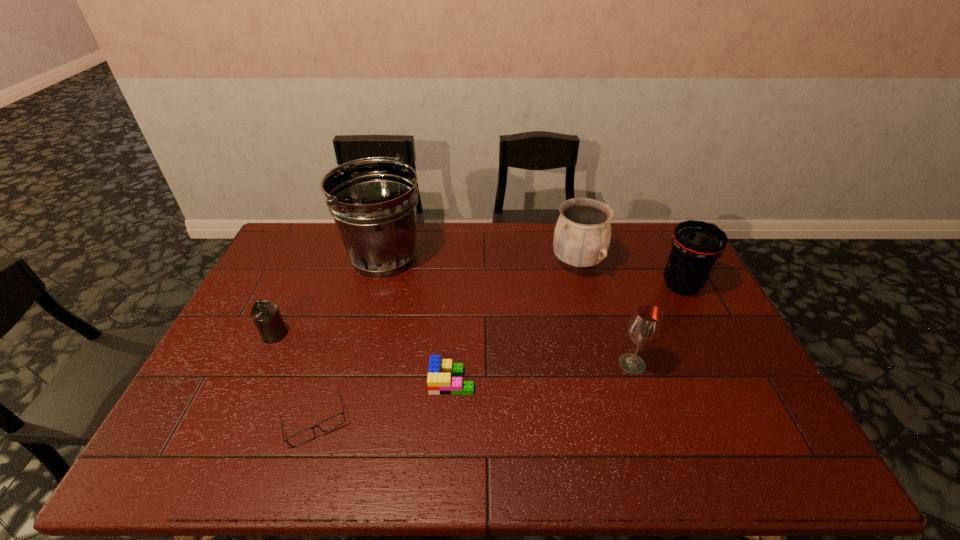
This screenshot has width=960, height=540. I want to click on the tallest object, so click(373, 201).

The image size is (960, 540). Identify the location of urn. (582, 235).

The width and height of the screenshot is (960, 540). I want to click on the rightmost object, so click(696, 244).

This screenshot has width=960, height=540. I want to click on wineglass, so click(644, 328).

The height and width of the screenshot is (540, 960). I want to click on can, so click(x=266, y=316).

I want to click on the leftmost object, so click(266, 316).

I want to click on Lego, so click(x=439, y=381).

This screenshot has width=960, height=540. In order to click on the nearest object in this screenshot , I will do `click(332, 422)`.

Locate an element on the screen. The height and width of the screenshot is (540, 960). vacant space positioned on the right of the tallest object is located at coordinates (470, 257).

I want to click on free space located on the right of the urn, so 681,264.